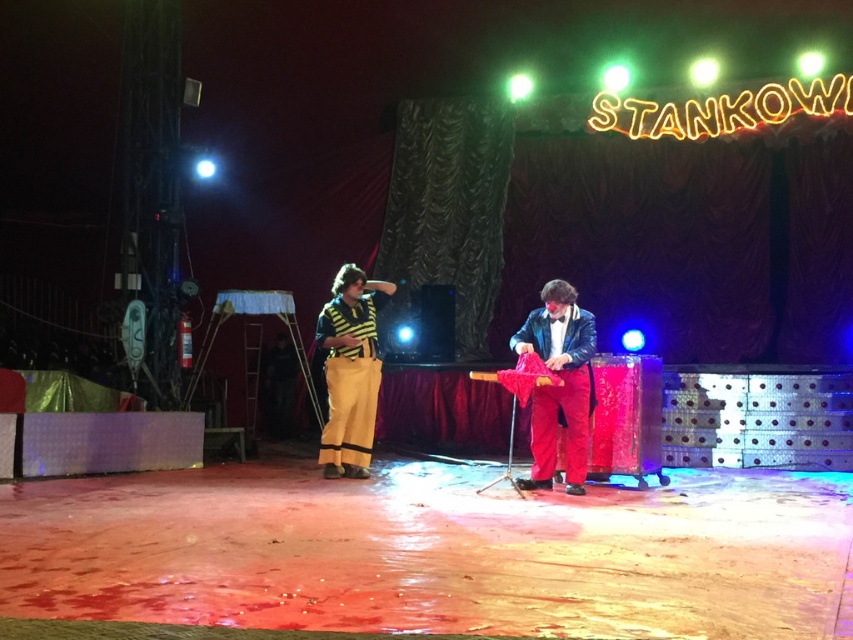
Question: Which object is farther from the camera taking this photo?

Choices:
 (A) shiny red pants at center
 (B) yellow striped pants at left

Answer: (B)

Question: Which point is farther to the camera?

Choices:
 (A) shiny red pants at center
 (B) yellow striped pants at left

Answer: (B)

Question: Is the position of shiny red pants at center less distant than that of yellow striped pants at left?

Choices:
 (A) no
 (B) yes

Answer: (B)

Question: Can you confirm if shiny red pants at center is positioned to the right of yellow striped pants at left?

Choices:
 (A) no
 (B) yes

Answer: (B)

Question: Can you confirm if shiny red pants at center is thinner than yellow striped pants at left?

Choices:
 (A) yes
 (B) no

Answer: (B)

Question: Which of the following is the farthest from the observer?

Choices:
 (A) (325, 428)
 (B) (573, 328)

Answer: (A)